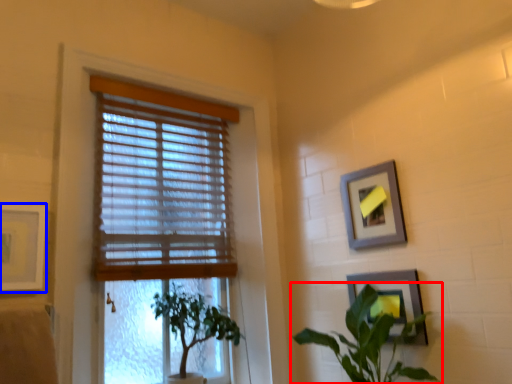
Question: Among these objects, which one is nearest to the camera, houseplant (highlighted by a red box) or picture frame (highlighted by a blue box)?

Choices:
 (A) houseplant
 (B) picture frame

Answer: (B)